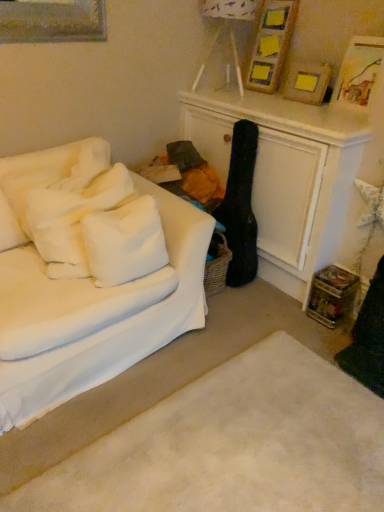
Question: Does white fabric couch at left have a lesser width compared to white fluffy pillow at left, the first pillow in the right-to-left sequence?

Choices:
 (A) no
 (B) yes

Answer: (A)

Question: Considering the relative sizes of white fabric couch at left and white fluffy pillow at left, which is the second pillow from left to right, in the image provided, is white fabric couch at left bigger than white fluffy pillow at left, which is the second pillow from left to right,?

Choices:
 (A) yes
 (B) no

Answer: (A)

Question: Is white fabric couch at left outside white fluffy pillow at left, the first pillow in the right-to-left sequence?

Choices:
 (A) yes
 (B) no

Answer: (A)

Question: Considering the relative positions of white fabric couch at left and white fluffy pillow at left, the first pillow in the right-to-left sequence, in the image provided, is white fabric couch at left to the right of white fluffy pillow at left, the first pillow in the right-to-left sequence, from the viewer's perspective?

Choices:
 (A) yes
 (B) no

Answer: (B)

Question: Is white fabric couch at left positioned behind white fluffy pillow at left, the first pillow in the right-to-left sequence?

Choices:
 (A) yes
 (B) no

Answer: (B)

Question: Considering the positions of white fabric couch at left and wooden picture frame at upper right, which ranks as the 3th picture frame in left-to-right order, in the image, is white fabric couch at left wider or thinner than wooden picture frame at upper right, which ranks as the 3th picture frame in left-to-right order,?

Choices:
 (A) wide
 (B) thin

Answer: (A)

Question: From the image's perspective, is white fabric couch at left located above or below wooden picture frame at upper right, arranged as the 1th picture frame when viewed from the right?

Choices:
 (A) below
 (B) above

Answer: (A)

Question: Is white fabric couch at left spatially inside wooden picture frame at upper right, which ranks as the 3th picture frame in left-to-right order, or outside of it?

Choices:
 (A) inside
 (B) outside

Answer: (B)

Question: Considering the positions of point (124, 315) and point (360, 73), is point (124, 315) closer or farther from the camera than point (360, 73)?

Choices:
 (A) farther
 (B) closer

Answer: (B)

Question: In the image, is wooden frame with yellow squares at upper right, the third picture frame from the right, on the left side or the right side of white soft pillows at left, positioned as the second pillow in right-to-left order?

Choices:
 (A) left
 (B) right

Answer: (B)

Question: Relative to white soft pillows at left, positioned as the second pillow in right-to-left order, is wooden frame with yellow squares at upper right, marked as the 1th picture frame in a left-to-right arrangement, in front or behind?

Choices:
 (A) front
 (B) behind

Answer: (B)

Question: Looking at the image, does wooden frame with yellow squares at upper right, the third picture frame from the right, seem bigger or smaller compared to white soft pillows at left, positioned as the second pillow in right-to-left order?

Choices:
 (A) big
 (B) small

Answer: (B)

Question: In terms of width, does wooden frame with yellow squares at upper right, the third picture frame from the right, look wider or thinner when compared to white soft pillows at left, positioned as the second pillow in right-to-left order?

Choices:
 (A) wide
 (B) thin

Answer: (B)

Question: Is wooden frame with yellow squares at upper right, the third picture frame from the right, taller or shorter than wooden picture frame at upper right, acting as the 2th picture frame starting from the left?

Choices:
 (A) tall
 (B) short

Answer: (A)

Question: Would you say wooden frame with yellow squares at upper right, the third picture frame from the right, is to the left or to the right of wooden picture frame at upper right, acting as the 2th picture frame starting from the left, in the picture?

Choices:
 (A) right
 (B) left

Answer: (B)